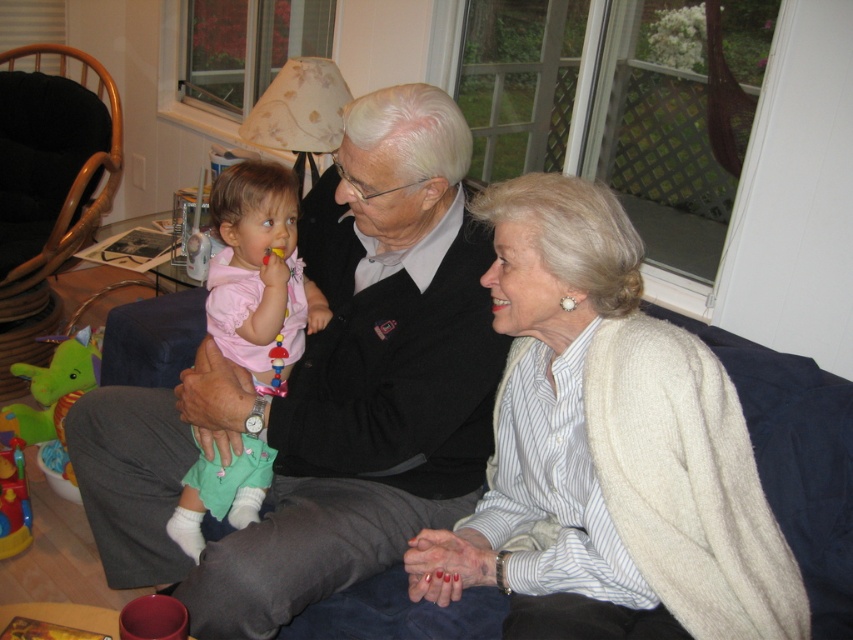
You are a photographer setting up for a family portrait. You notice the matte black sweater at center and the brown woven armchair at left in the scene. Which object should you adjust to ensure both are visible in the frame without cropping? Explain your reasoning based on their sizes.

The matte black sweater at center has a smaller size compared to the brown woven armchair at left. Since the sweater is smaller, it might be easier to adjust its position to ensure both objects fit within the frame without cropping. Alternatively, you could widen the camera angle to accommodate both sizes.